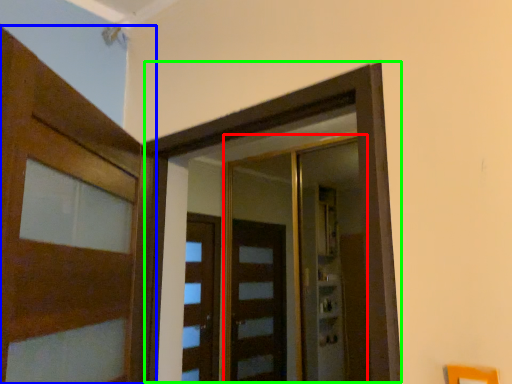
Question: Which is nearer to the elevator (highlighted by a red box)? door (highlighted by a blue box) or elevator (highlighted by a green box).

Choices:
 (A) door
 (B) elevator

Answer: (B)